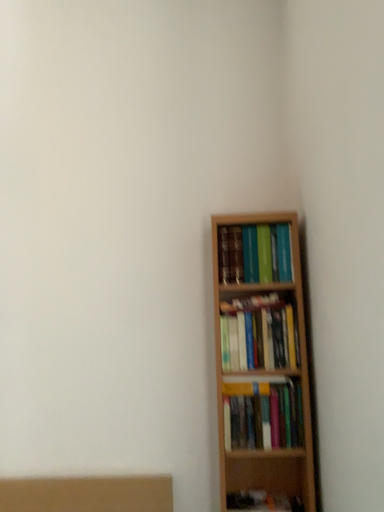
Measure the distance between hardcover books at upper right, the third book ordered from the bottom, and camera.

hardcover books at upper right, the third book ordered from the bottom, is 1.47 meters away from camera.

Measure the distance between point (x=241, y=426) and camera.

The depth of point (x=241, y=426) is 4.69 feet.

Measure the distance between wooden bookshelf at right, the second book viewed from the top, and camera.

wooden bookshelf at right, the second book viewed from the top, is 4.74 feet away from camera.

Where is `hardcover books at upper right, the third book ordered from the bottom`? The height and width of the screenshot is (512, 384). hardcover books at upper right, the third book ordered from the bottom is located at coordinates click(x=258, y=253).

Considering the sizes of objects hardcover books at upper right, marked as the 1th book in a top-to-bottom arrangement, and wooden bookshelf at right, the second book viewed from the top, in the image provided, who is taller, hardcover books at upper right, marked as the 1th book in a top-to-bottom arrangement, or wooden bookshelf at right, the second book viewed from the top,?

wooden bookshelf at right, the second book viewed from the top.

Based on the photo, from a real-world perspective, is hardcover books at upper right, marked as the 1th book in a top-to-bottom arrangement, physically above wooden bookshelf at right, placed as the 2th book when sorted from bottom to top?

Indeed, from a real-world perspective, hardcover books at upper right, marked as the 1th book in a top-to-bottom arrangement, stands above wooden bookshelf at right, placed as the 2th book when sorted from bottom to top.

Where is `book that is the 1st one below the hardcover books at upper right, the third book ordered from the bottom (from a real-world perspective)`? book that is the 1st one below the hardcover books at upper right, the third book ordered from the bottom (from a real-world perspective) is located at coordinates (259, 334).

From the image's perspective, is hardcover books at upper right, marked as the 1th book in a top-to-bottom arrangement, under wooden bookshelf at right, placed as the 2th book when sorted from bottom to top?

No, from the image's perspective, hardcover books at upper right, marked as the 1th book in a top-to-bottom arrangement, is not beneath wooden bookshelf at right, placed as the 2th book when sorted from bottom to top.

Is wooden bookshelf at right, placed as the 1th book when sorted from bottom to top, not inside hardcover books at upper right, marked as the 1th book in a top-to-bottom arrangement?

Yes, wooden bookshelf at right, placed as the 1th book when sorted from bottom to top, is not within hardcover books at upper right, marked as the 1th book in a top-to-bottom arrangement.

Considering the relative sizes of wooden bookshelf at right, placed as the 1th book when sorted from bottom to top, and hardcover books at upper right, marked as the 1th book in a top-to-bottom arrangement, in the image provided, is wooden bookshelf at right, placed as the 1th book when sorted from bottom to top, thinner than hardcover books at upper right, marked as the 1th book in a top-to-bottom arrangement,?

Correct, the width of wooden bookshelf at right, placed as the 1th book when sorted from bottom to top, is less than that of hardcover books at upper right, marked as the 1th book in a top-to-bottom arrangement.

Considering the relative sizes of wooden bookshelf at right, placed as the 1th book when sorted from bottom to top, and hardcover books at upper right, marked as the 1th book in a top-to-bottom arrangement, in the image provided, is wooden bookshelf at right, placed as the 1th book when sorted from bottom to top, smaller than hardcover books at upper right, marked as the 1th book in a top-to-bottom arrangement,?

Indeed, wooden bookshelf at right, placed as the 1th book when sorted from bottom to top, has a smaller size compared to hardcover books at upper right, marked as the 1th book in a top-to-bottom arrangement.

Is there a large distance between wooden bookshelf at right, marked as the third book in a top-to-bottom arrangement, and hardcover books at upper right, the third book ordered from the bottom?

No, wooden bookshelf at right, marked as the third book in a top-to-bottom arrangement, is not far away from hardcover books at upper right, the third book ordered from the bottom.

Considering the relative sizes of wooden bookshelf at right, the second book viewed from the top, and hardcover books at upper right, the third book ordered from the bottom, in the image provided, is wooden bookshelf at right, the second book viewed from the top, thinner than hardcover books at upper right, the third book ordered from the bottom,?

Indeed, wooden bookshelf at right, the second book viewed from the top, has a lesser width compared to hardcover books at upper right, the third book ordered from the bottom.

Is wooden bookshelf at right, the second book viewed from the top, turned away from hardcover books at upper right, the third book ordered from the bottom?

wooden bookshelf at right, the second book viewed from the top, does not have its back to hardcover books at upper right, the third book ordered from the bottom.

Considering the points (255, 325) and (219, 248), which point is behind, point (255, 325) or point (219, 248)?

The point (219, 248) is farther.

How different are the orientations of wooden bookshelf at right, the second book viewed from the top, and hardcover books at upper right, marked as the 1th book in a top-to-bottom arrangement, in degrees?

wooden bookshelf at right, the second book viewed from the top, and hardcover books at upper right, marked as the 1th book in a top-to-bottom arrangement, are facing 2.7 degrees away from each other.

Is wooden bookshelf at right, the second book viewed from the top, closer to camera compared to wooden bookshelf at right, placed as the 1th book when sorted from bottom to top?

No.

From the image's perspective, between wooden bookshelf at right, placed as the 2th book when sorted from bottom to top, and wooden bookshelf at right, placed as the 1th book when sorted from bottom to top, which one is located above?

wooden bookshelf at right, placed as the 2th book when sorted from bottom to top, from the image's perspective.

Considering the relative positions of wooden bookshelf at right, placed as the 2th book when sorted from bottom to top, and wooden bookshelf at right, marked as the third book in a top-to-bottom arrangement, in the image provided, is wooden bookshelf at right, placed as the 2th book when sorted from bottom to top, to the left or to the right of wooden bookshelf at right, marked as the third book in a top-to-bottom arrangement,?

wooden bookshelf at right, placed as the 2th book when sorted from bottom to top, is to the left of wooden bookshelf at right, marked as the third book in a top-to-bottom arrangement.

Looking at this image, measure the distance between wooden bookshelf at right, the second book viewed from the top, and wooden bookshelf at right, placed as the 1th book when sorted from bottom to top.

wooden bookshelf at right, the second book viewed from the top, and wooden bookshelf at right, placed as the 1th book when sorted from bottom to top, are 6.01 inches apart.

Is hardcover books at upper right, the third book ordered from the bottom, located outside wooden bookshelf at right, marked as the third book in a top-to-bottom arrangement?

Yes.

Is hardcover books at upper right, marked as the 1th book in a top-to-bottom arrangement, taller or shorter than wooden bookshelf at right, marked as the third book in a top-to-bottom arrangement?

Clearly, hardcover books at upper right, marked as the 1th book in a top-to-bottom arrangement, is taller compared to wooden bookshelf at right, marked as the third book in a top-to-bottom arrangement.

The width and height of the screenshot is (384, 512). I want to click on book that is the 2nd one above the wooden bookshelf at right, placed as the 1th book when sorted from bottom to top (from a real-world perspective), so click(258, 253).

From a real-world perspective, does hardcover books at upper right, the third book ordered from the bottom, stand above wooden bookshelf at right, marked as the third book in a top-to-bottom arrangement?

Indeed, from a real-world perspective, hardcover books at upper right, the third book ordered from the bottom, stands above wooden bookshelf at right, marked as the third book in a top-to-bottom arrangement.

Is wooden bookshelf at right, marked as the third book in a top-to-bottom arrangement, oriented towards wooden bookshelf at right, the second book viewed from the top?

No, wooden bookshelf at right, marked as the third book in a top-to-bottom arrangement, is not facing towards wooden bookshelf at right, the second book viewed from the top.

Measure the distance from wooden bookshelf at right, placed as the 1th book when sorted from bottom to top, to wooden bookshelf at right, placed as the 2th book when sorted from bottom to top.

wooden bookshelf at right, placed as the 1th book when sorted from bottom to top, and wooden bookshelf at right, placed as the 2th book when sorted from bottom to top, are 15.26 centimeters apart.

Is wooden bookshelf at right, placed as the 1th book when sorted from bottom to top, directly adjacent to wooden bookshelf at right, the second book viewed from the top?

wooden bookshelf at right, placed as the 1th book when sorted from bottom to top, and wooden bookshelf at right, the second book viewed from the top, are clearly separated.

Considering the relative sizes of wooden bookshelf at right, marked as the third book in a top-to-bottom arrangement, and wooden bookshelf at right, the second book viewed from the top, in the image provided, is wooden bookshelf at right, marked as the third book in a top-to-bottom arrangement, thinner than wooden bookshelf at right, the second book viewed from the top,?

No.

Identify the location of book located on the left of wooden bookshelf at right, placed as the 2th book when sorted from bottom to top. This screenshot has width=384, height=512. (258, 253).

Locate an element on the screen. This screenshot has height=512, width=384. the 2nd book directly beneath the hardcover books at upper right, the third book ordered from the bottom (from a real-world perspective) is located at coordinates (263, 415).

When comparing their distances from hardcover books at upper right, marked as the 1th book in a top-to-bottom arrangement, does wooden bookshelf at right, placed as the 2th book when sorted from bottom to top, or wooden bookshelf at right, marked as the third book in a top-to-bottom arrangement, seem further?

Among the two, wooden bookshelf at right, marked as the third book in a top-to-bottom arrangement, is located further to hardcover books at upper right, marked as the 1th book in a top-to-bottom arrangement.

When comparing their distances from wooden bookshelf at right, marked as the third book in a top-to-bottom arrangement, does wooden bookshelf at right, the second book viewed from the top, or hardcover books at upper right, marked as the 1th book in a top-to-bottom arrangement, seem closer?

wooden bookshelf at right, the second book viewed from the top, is positioned closer to the anchor wooden bookshelf at right, marked as the third book in a top-to-bottom arrangement.

Considering their positions, is wooden bookshelf at right, placed as the 1th book when sorted from bottom to top, positioned further to wooden bookshelf at right, placed as the 2th book when sorted from bottom to top, than hardcover books at upper right, marked as the 1th book in a top-to-bottom arrangement?

Among the two, hardcover books at upper right, marked as the 1th book in a top-to-bottom arrangement, is located further to wooden bookshelf at right, placed as the 2th book when sorted from bottom to top.

Considering their positions, is hardcover books at upper right, the third book ordered from the bottom, positioned closer to wooden bookshelf at right, marked as the third book in a top-to-bottom arrangement, than wooden bookshelf at right, the second book viewed from the top?

wooden bookshelf at right, the second book viewed from the top, is positioned closer to the anchor wooden bookshelf at right, marked as the third book in a top-to-bottom arrangement.

Estimate the real-world distances between objects in this image. Which object is closer to wooden bookshelf at right, placed as the 2th book when sorted from bottom to top, hardcover books at upper right, the third book ordered from the bottom, or wooden bookshelf at right, marked as the third book in a top-to-bottom arrangement?

wooden bookshelf at right, marked as the third book in a top-to-bottom arrangement, is positioned closer to the anchor wooden bookshelf at right, placed as the 2th book when sorted from bottom to top.

Looking at this image, estimate the real-world distances between objects in this image. Which object is further from hardcover books at upper right, marked as the 1th book in a top-to-bottom arrangement, wooden bookshelf at right, marked as the third book in a top-to-bottom arrangement, or wooden bookshelf at right, placed as the 2th book when sorted from bottom to top?

wooden bookshelf at right, marked as the third book in a top-to-bottom arrangement, lies further to hardcover books at upper right, marked as the 1th book in a top-to-bottom arrangement, than the other object.

Locate an element on the screen. The width and height of the screenshot is (384, 512). book between hardcover books at upper right, the third book ordered from the bottom, and wooden bookshelf at right, marked as the third book in a top-to-bottom arrangement, in the vertical direction is located at coordinates (259, 334).